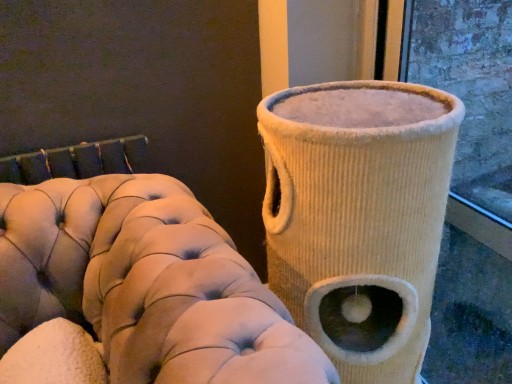
Question: Is beige corduroy cat tree at right to the right of beige corduroy cat tree at right from the viewer's perspective?

Choices:
 (A) no
 (B) yes

Answer: (A)

Question: Considering the relative sizes of beige corduroy cat tree at right and beige corduroy cat tree at right in the image provided, is beige corduroy cat tree at right smaller than beige corduroy cat tree at right?

Choices:
 (A) yes
 (B) no

Answer: (B)

Question: Does beige corduroy cat tree at right contain beige corduroy cat tree at right?

Choices:
 (A) yes
 (B) no

Answer: (B)

Question: Can you confirm if beige corduroy cat tree at right is shorter than beige corduroy cat tree at right?

Choices:
 (A) yes
 (B) no

Answer: (A)

Question: Is there a large distance between beige corduroy cat tree at right and beige corduroy cat tree at right?

Choices:
 (A) no
 (B) yes

Answer: (A)

Question: Considering the relative sizes of beige corduroy cat tree at right and beige corduroy cat tree at right in the image provided, is beige corduroy cat tree at right thinner than beige corduroy cat tree at right?

Choices:
 (A) yes
 (B) no

Answer: (B)

Question: From a real-world perspective, is beige corduroy cat tree at right physically below beige corduroy cat tree at right?

Choices:
 (A) yes
 (B) no

Answer: (A)

Question: Is beige corduroy cat tree at right facing towards beige corduroy cat tree at right?

Choices:
 (A) yes
 (B) no

Answer: (B)

Question: Does beige corduroy cat tree at right lie behind beige corduroy cat tree at right?

Choices:
 (A) no
 (B) yes

Answer: (B)

Question: Does beige corduroy cat tree at right come in front of beige corduroy cat tree at right?

Choices:
 (A) yes
 (B) no

Answer: (B)

Question: Is beige corduroy cat tree at right located outside beige corduroy cat tree at right?

Choices:
 (A) no
 (B) yes

Answer: (B)

Question: Is beige corduroy cat tree at right wider than beige corduroy cat tree at right?

Choices:
 (A) yes
 (B) no

Answer: (B)

Question: Considering the positions of beige corduroy cat tree at right and beige corduroy cat tree at right in the image, is beige corduroy cat tree at right taller or shorter than beige corduroy cat tree at right?

Choices:
 (A) short
 (B) tall

Answer: (A)